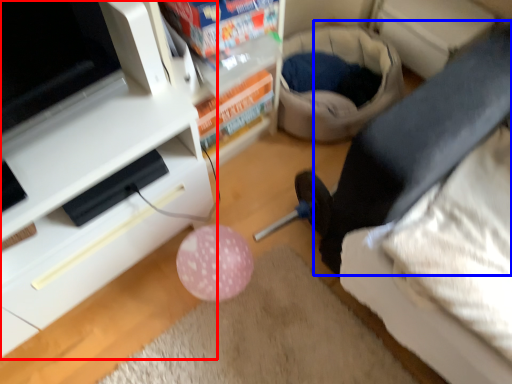
Question: Which object appears farthest to the camera in this image, furniture (highlighted by a red box) or leg (highlighted by a blue box)?

Choices:
 (A) furniture
 (B) leg

Answer: (B)